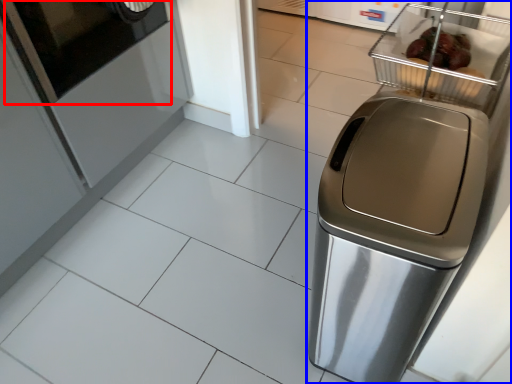
Question: Which object is closer to the camera taking this photo, screen door (highlighted by a red box) or home appliance (highlighted by a blue box)?

Choices:
 (A) screen door
 (B) home appliance

Answer: (B)